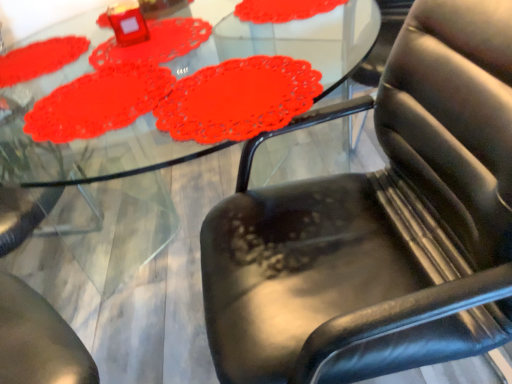
Question: Is black leather chair at lower right spatially inside matte red doily at upper center, which is the second mat from front to back, or outside of it?

Choices:
 (A) inside
 (B) outside

Answer: (B)

Question: Looking at their shapes, would you say black leather chair at lower right is wider or thinner than matte red doily at upper center, the 2th mat viewed from the back?

Choices:
 (A) wide
 (B) thin

Answer: (A)

Question: Which of these objects is positioned closest to the matte red doily at upper center, the 2th mat viewed from the back?

Choices:
 (A) black leather chair at lower right
 (B) matte red doily at upper left, placed as the 1th mat when sorted from front to back
 (C) matte red doily at upper left, which is the 3th mat from front to back

Answer: (B)

Question: Estimate the real-world distances between objects in this image. Which object is farther from the black leather chair at lower right?

Choices:
 (A) matte red doily at upper left, which is the 3th mat from front to back
 (B) matte red doily at upper center, the 2th mat viewed from the back
 (C) matte red doily at upper left, placed as the 1th mat when sorted from front to back

Answer: (A)